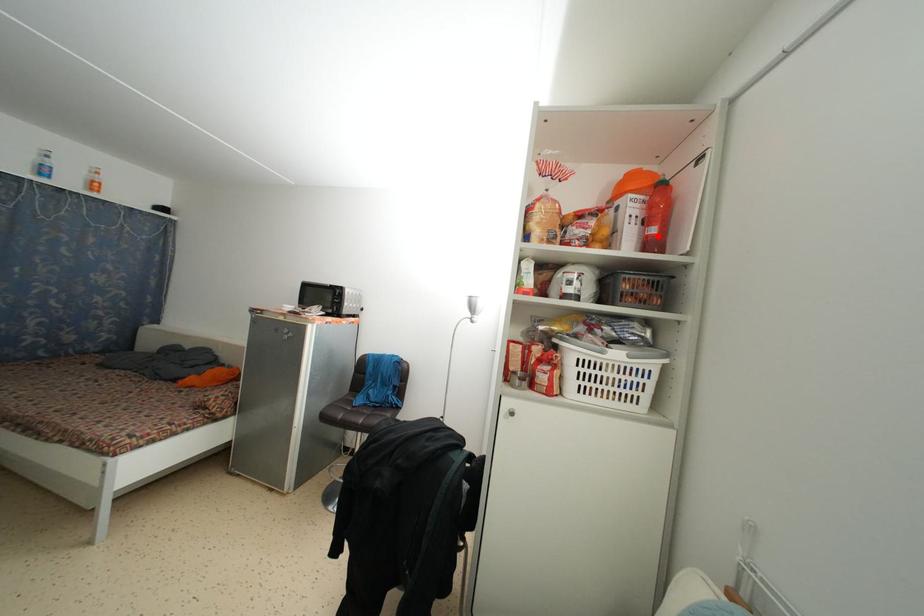
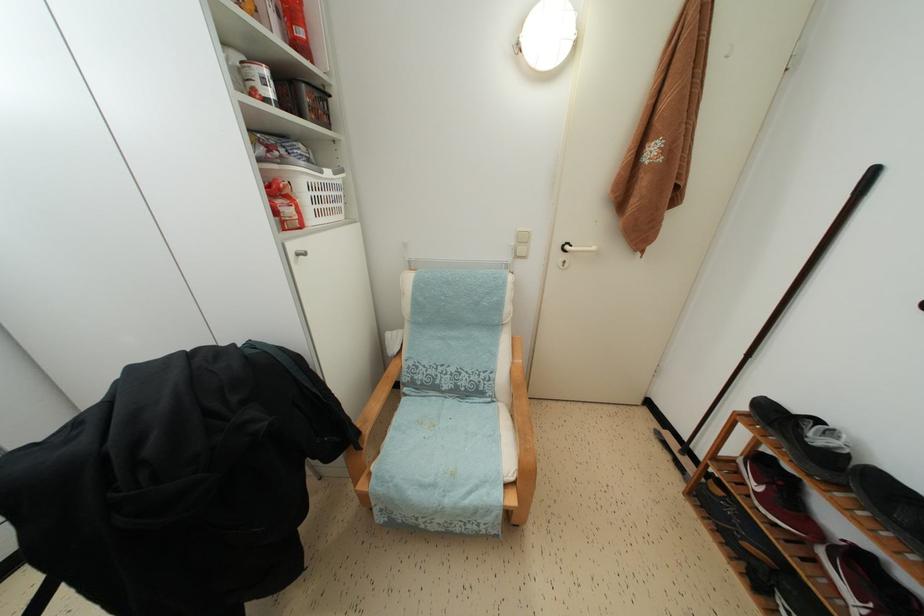
Where in the second image is the point corresponding to the highlighted location from the first image?

(305, 38)